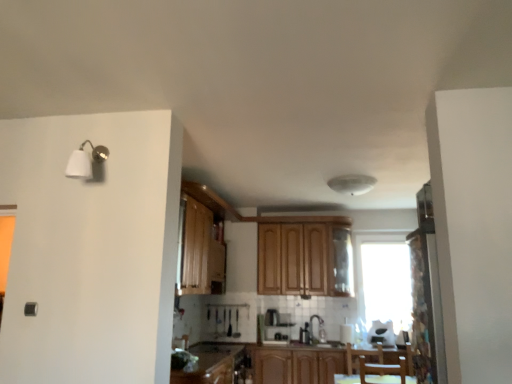
Question: Is brown wooden chair at lower center next to patterned fabric screen door at right?

Choices:
 (A) no
 (B) yes

Answer: (A)

Question: Does brown wooden chair at lower center have a lesser height compared to patterned fabric screen door at right?

Choices:
 (A) no
 (B) yes

Answer: (B)

Question: Is brown wooden chair at lower center behind patterned fabric screen door at right?

Choices:
 (A) no
 (B) yes

Answer: (B)

Question: Is brown wooden chair at lower center bigger than patterned fabric screen door at right?

Choices:
 (A) no
 (B) yes

Answer: (B)

Question: Is brown wooden chair at lower center facing towards patterned fabric screen door at right?

Choices:
 (A) no
 (B) yes

Answer: (B)

Question: In the image, is wooden cabinet at lower center, which is the second cabinetry from top to bottom, on the left side or the right side of white glossy sink at center?

Choices:
 (A) right
 (B) left

Answer: (B)

Question: Is point (226, 380) closer or farther from the camera than point (309, 337)?

Choices:
 (A) farther
 (B) closer

Answer: (B)

Question: Considering the positions of wooden cabinet at lower center, which is the second cabinetry from top to bottom, and white glossy sink at center in the image, is wooden cabinet at lower center, which is the second cabinetry from top to bottom, bigger or smaller than white glossy sink at center?

Choices:
 (A) small
 (B) big

Answer: (B)

Question: In terms of width, does wooden cabinet at lower center, arranged as the second cabinetry when ordered from the bottom, look wider or thinner when compared to white glossy sink at center?

Choices:
 (A) thin
 (B) wide

Answer: (B)

Question: Is satin silver coffee machine at center in front of or behind white glossy toaster at center in the image?

Choices:
 (A) front
 (B) behind

Answer: (B)

Question: Looking at their shapes, would you say satin silver coffee machine at center is wider or thinner than white glossy toaster at center?

Choices:
 (A) wide
 (B) thin

Answer: (A)

Question: Considering the positions of satin silver coffee machine at center and white glossy toaster at center in the image, is satin silver coffee machine at center bigger or smaller than white glossy toaster at center?

Choices:
 (A) small
 (B) big

Answer: (B)

Question: In terms of height, does satin silver coffee machine at center look taller or shorter compared to white glossy toaster at center?

Choices:
 (A) tall
 (B) short

Answer: (A)

Question: From a real-world perspective, relative to brown wooden chair at lower center, is white glossy toaster at center vertically above or below?

Choices:
 (A) below
 (B) above

Answer: (B)

Question: Is white glossy toaster at center inside the boundaries of brown wooden chair at lower center, or outside?

Choices:
 (A) outside
 (B) inside

Answer: (A)